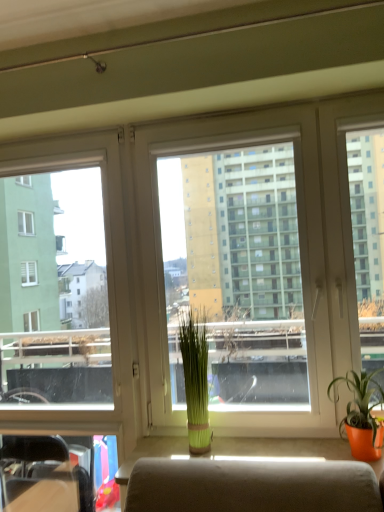
Question: Is matte orange pot at right, the 1th houseplant positioned from the front, shorter than green matte plant at center, the first houseplant viewed from the back?

Choices:
 (A) yes
 (B) no

Answer: (A)

Question: From a real-world perspective, is matte orange pot at right, which appears as the second houseplant when viewed from the left, positioned under green matte plant at center, which is the 1th houseplant in left-to-right order, based on gravity?

Choices:
 (A) no
 (B) yes

Answer: (B)

Question: Considering the relative positions of matte orange pot at right, arranged as the first houseplant when viewed from the right, and green matte plant at center, which ranks as the 2th houseplant in right-to-left order, in the image provided, is matte orange pot at right, arranged as the first houseplant when viewed from the right, in front of green matte plant at center, which ranks as the 2th houseplant in right-to-left order,?

Choices:
 (A) yes
 (B) no

Answer: (A)

Question: Is green matte plant at center, which ranks as the 2th houseplant in right-to-left order, inside matte orange pot at right, arranged as the first houseplant when viewed from the right?

Choices:
 (A) yes
 (B) no

Answer: (B)

Question: Is matte orange pot at right, arranged as the first houseplant when viewed from the right, facing away from green matte plant at center, which ranks as the 2th houseplant in right-to-left order?

Choices:
 (A) yes
 (B) no

Answer: (B)

Question: Is matte orange pot at right, the 2th houseplant viewed from the back, thinner than green matte plant at center, the first houseplant viewed from the back?

Choices:
 (A) no
 (B) yes

Answer: (A)

Question: From a real-world perspective, is transparent glass window at left located beneath transparent plastic window screen at center?

Choices:
 (A) yes
 (B) no

Answer: (A)

Question: Is transparent glass window at left closer to the viewer compared to transparent plastic window screen at center?

Choices:
 (A) yes
 (B) no

Answer: (B)

Question: Can you confirm if transparent glass window at left is bigger than transparent plastic window screen at center?

Choices:
 (A) no
 (B) yes

Answer: (A)

Question: From the image's perspective, is transparent glass window at left located above transparent plastic window screen at center?

Choices:
 (A) no
 (B) yes

Answer: (A)

Question: Could you tell me if transparent glass window at left is facing transparent plastic window screen at center?

Choices:
 (A) no
 (B) yes

Answer: (A)

Question: Is transparent glass window at left not inside transparent plastic window screen at center?

Choices:
 (A) no
 (B) yes

Answer: (B)

Question: Does transparent plastic window screen at center have a smaller size compared to green matte plant at center, which is the 1th houseplant in left-to-right order?

Choices:
 (A) no
 (B) yes

Answer: (A)